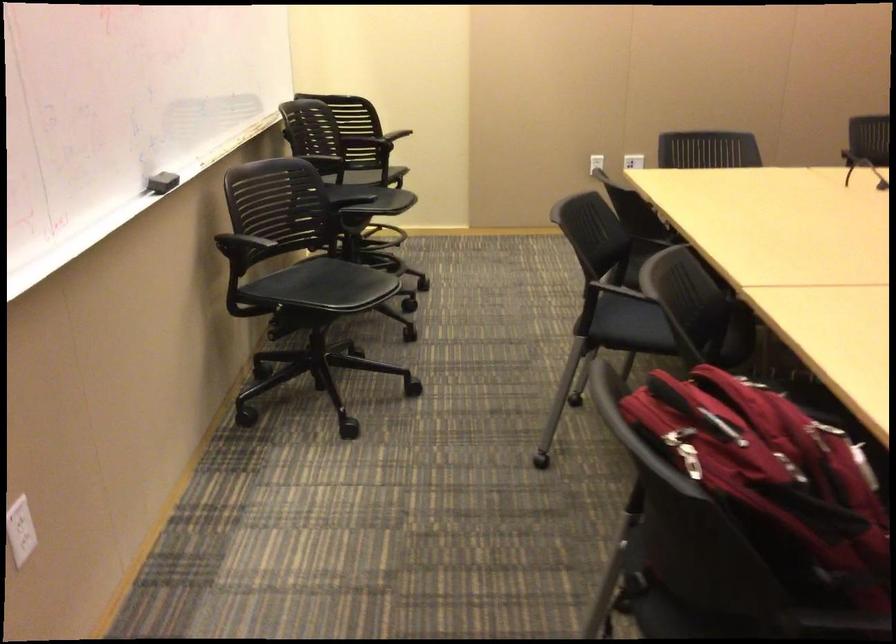
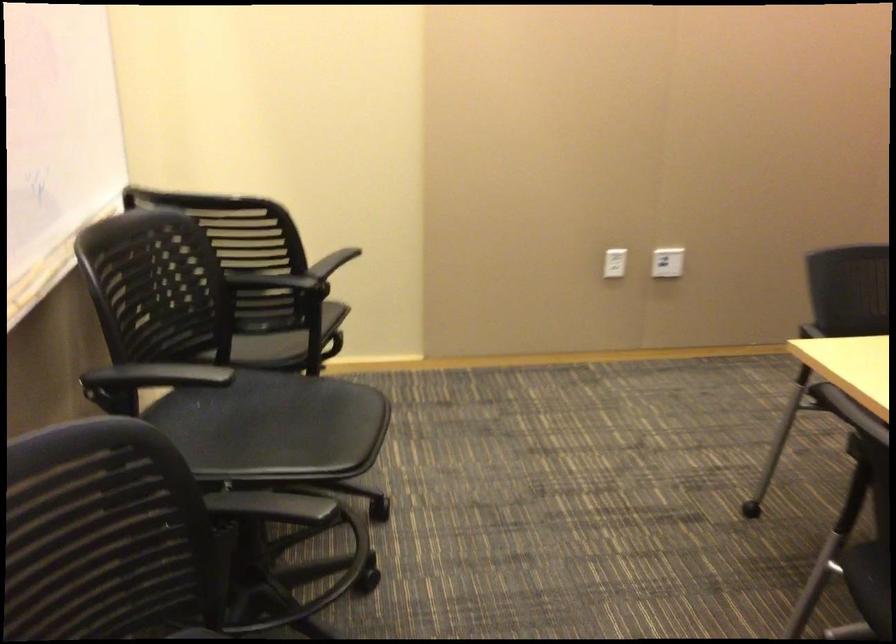
In the second image, find the point that corresponds to (x=606, y=158) in the first image.

(615, 263)